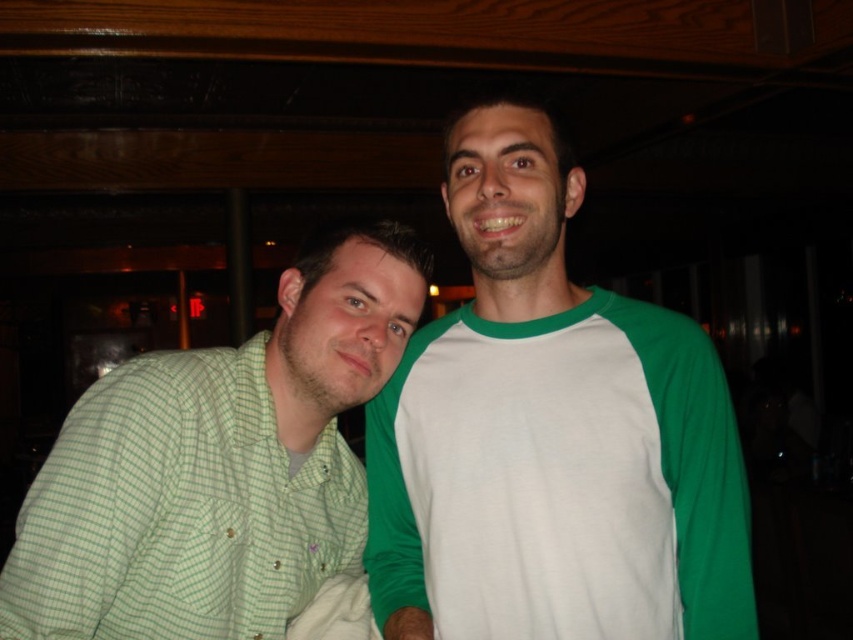
Is white/green raglan shirt at center closer to camera compared to green checkered shirt at left?

No, white/green raglan shirt at center is further to the viewer.

Find the location of `white/green raglan shirt at center`. white/green raglan shirt at center is located at coordinates tap(550, 435).

Identify the location of white/green raglan shirt at center. coord(550,435).